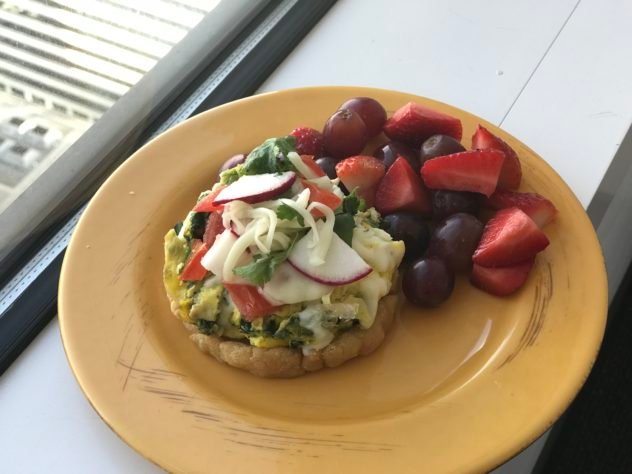
This screenshot has width=632, height=474. In order to click on plate in this screenshot , I will do (x=197, y=430).